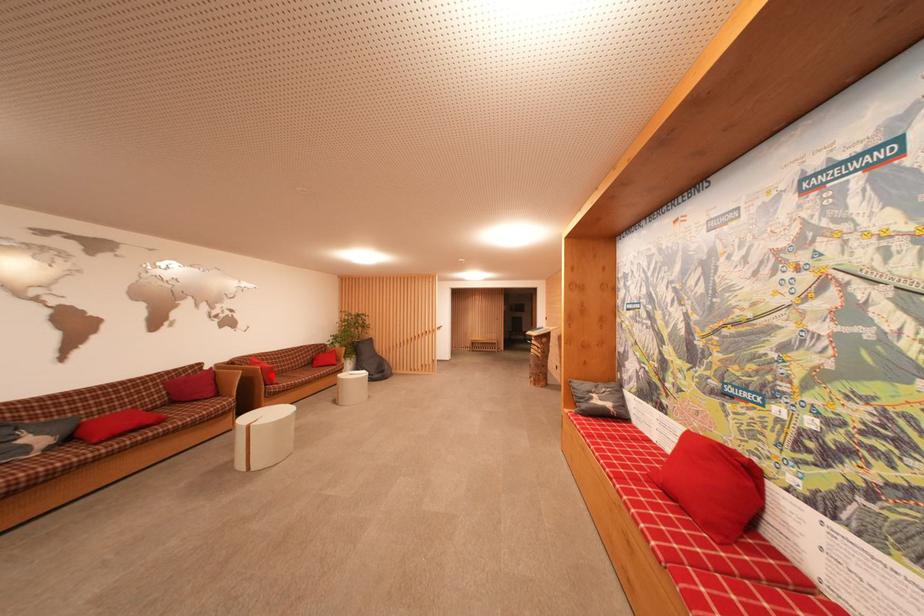
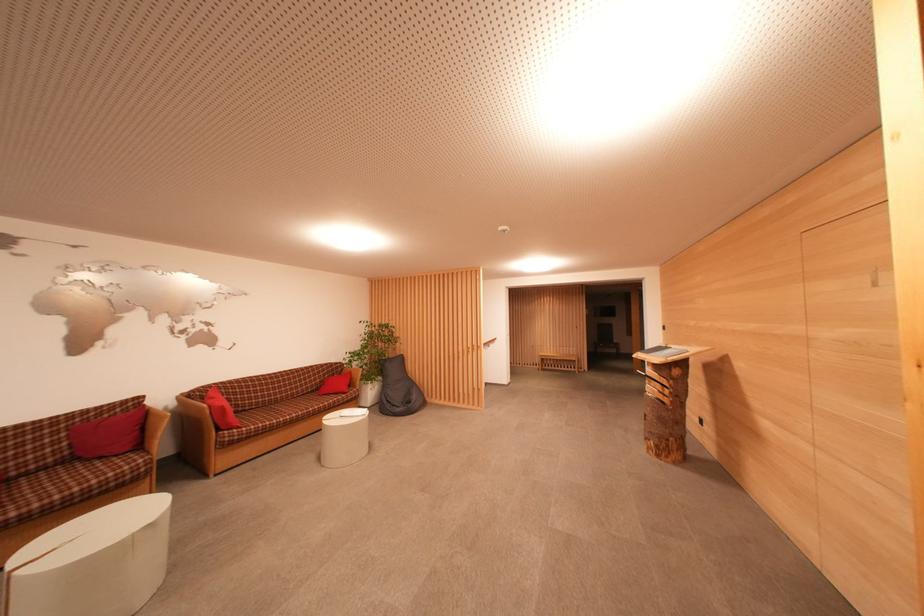
Question: A red point is marked in image1. In image2, is the corresponding 3D point closer to the camera or farther? Reply with the corresponding letter.

Choices:
 (A) The corresponding 3D point is closer.
 (B) The corresponding 3D point is farther.

Answer: (B)